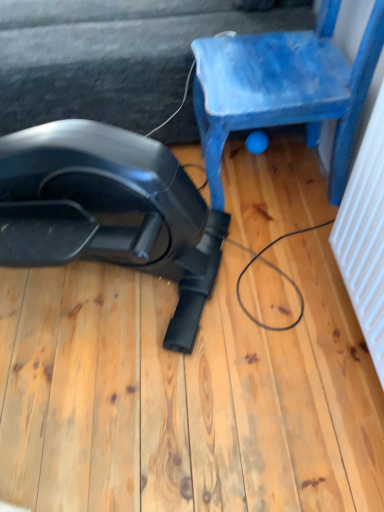
Question: From a real-world perspective, is black plastic vacuum cleaner at lower left positioned over blue painted wood chair at upper right based on gravity?

Choices:
 (A) yes
 (B) no

Answer: (B)

Question: Is blue painted wood chair at upper right surrounded by black plastic vacuum cleaner at lower left?

Choices:
 (A) no
 (B) yes

Answer: (A)

Question: From the image's perspective, would you say black plastic vacuum cleaner at lower left is shown under blue painted wood chair at upper right?

Choices:
 (A) yes
 (B) no

Answer: (B)

Question: Can you confirm if black plastic vacuum cleaner at lower left is shorter than blue painted wood chair at upper right?

Choices:
 (A) yes
 (B) no

Answer: (A)

Question: Considering the relative sizes of black plastic vacuum cleaner at lower left and blue painted wood chair at upper right in the image provided, is black plastic vacuum cleaner at lower left smaller than blue painted wood chair at upper right?

Choices:
 (A) yes
 (B) no

Answer: (B)

Question: Is black plastic vacuum cleaner at lower left to the left of blue painted wood chair at upper right from the viewer's perspective?

Choices:
 (A) yes
 (B) no

Answer: (A)

Question: From a real-world perspective, is black plastic vacuum cleaner at lower left physically above black rubber vacuum cleaner at lower left?

Choices:
 (A) yes
 (B) no

Answer: (B)

Question: Considering the relative sizes of black plastic vacuum cleaner at lower left and black rubber vacuum cleaner at lower left in the image provided, is black plastic vacuum cleaner at lower left wider than black rubber vacuum cleaner at lower left?

Choices:
 (A) yes
 (B) no

Answer: (A)

Question: Could you tell me if black plastic vacuum cleaner at lower left is turned towards black rubber vacuum cleaner at lower left?

Choices:
 (A) yes
 (B) no

Answer: (B)

Question: Is black plastic vacuum cleaner at lower left not near black rubber vacuum cleaner at lower left?

Choices:
 (A) yes
 (B) no

Answer: (B)

Question: Does black plastic vacuum cleaner at lower left come behind black rubber vacuum cleaner at lower left?

Choices:
 (A) yes
 (B) no

Answer: (A)

Question: Is black plastic vacuum cleaner at lower left next to black rubber vacuum cleaner at lower left and touching it?

Choices:
 (A) no
 (B) yes

Answer: (A)

Question: Considering the relative sizes of black rubber vacuum cleaner at lower left and black plastic vacuum cleaner at lower left in the image provided, is black rubber vacuum cleaner at lower left smaller than black plastic vacuum cleaner at lower left?

Choices:
 (A) no
 (B) yes

Answer: (B)